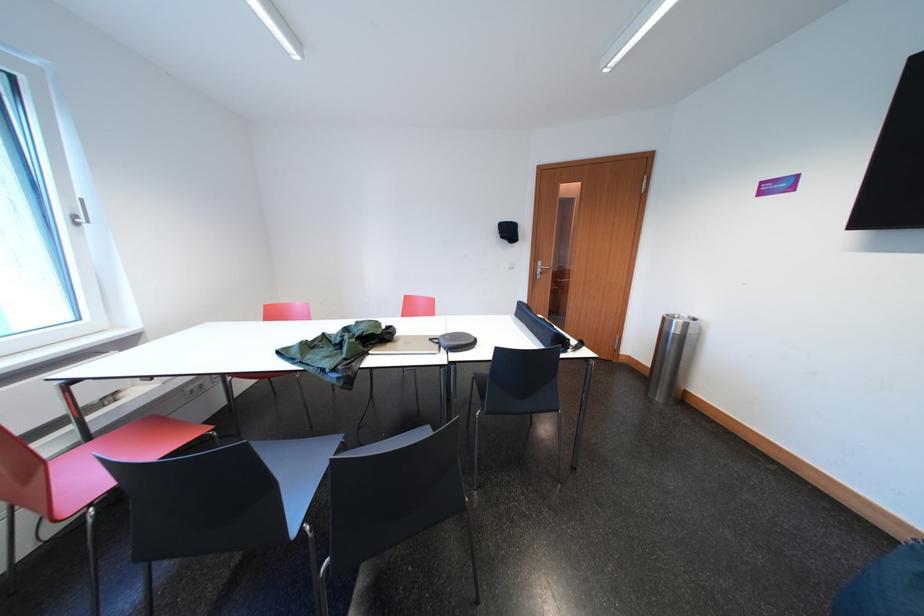
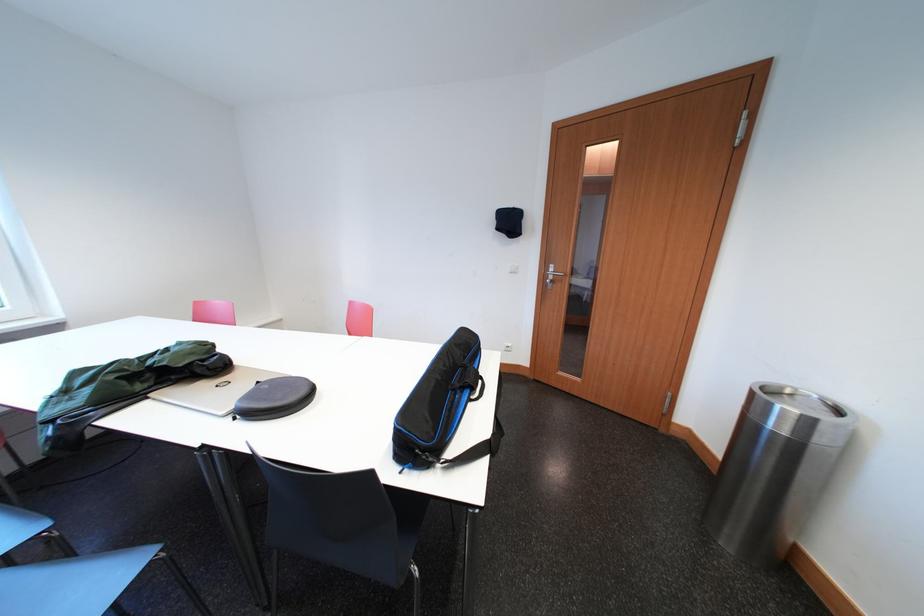
In the second image, find the point that corresponds to (x=696, y=330) in the first image.

(819, 426)